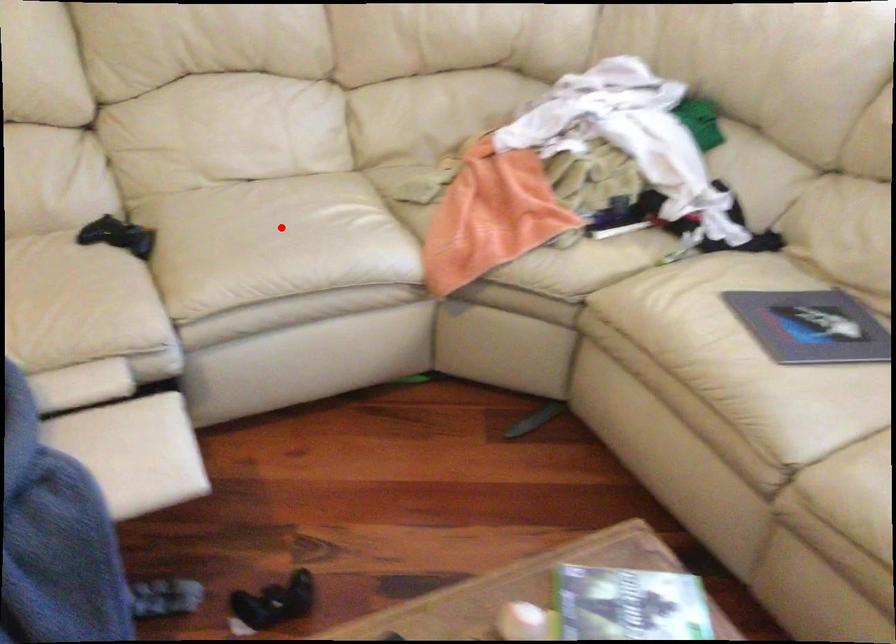
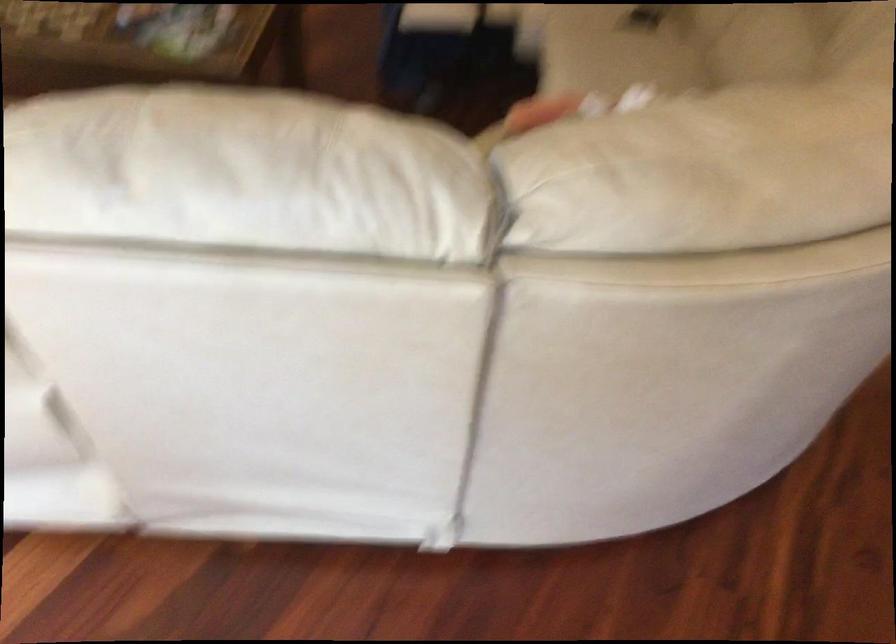
In the second image, find the point that corresponds to the highlighted location in the first image.

(616, 49)